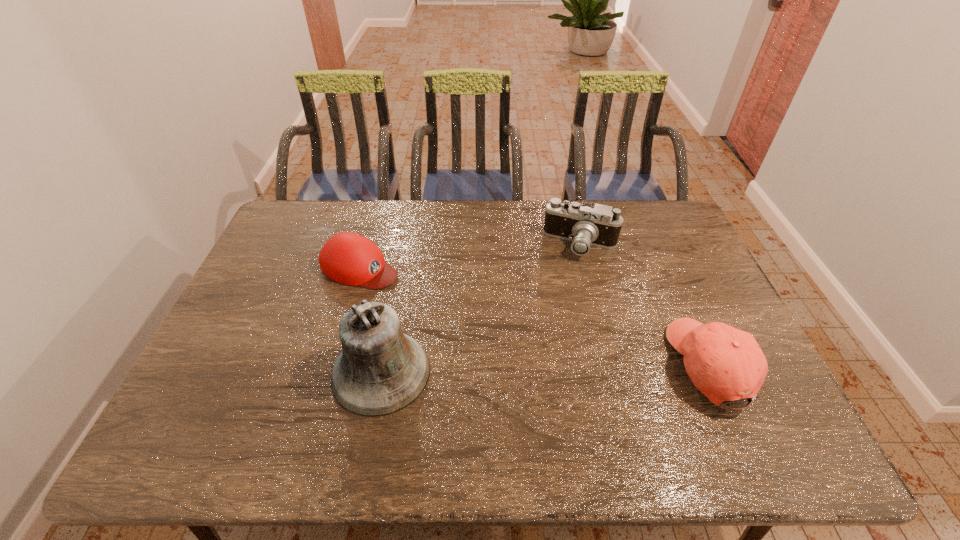
You are a GUI agent. You are given a task and a screenshot of the screen. Output one action in this format:
    pyautogui.click(x=<x>, y=<y>)
    Task: Click on the free space between the taller baseball cap and the shortest object
    
    Given the screenshot: What is the action you would take?
    pyautogui.click(x=536, y=316)

Locate which object is the third closest to the left baseball cap. Please provide its 2D coordinates. Your answer should be formatted as a tuple, i.e. [(x, y)], where the tuple contains the x and y coordinates of a point satisfying the conditions above.

[(726, 364)]

Locate an element on the screen. object that stands as the third closest to the camera is located at coordinates click(x=348, y=258).

The width and height of the screenshot is (960, 540). Find the location of `vacant space that satisfies the following two spatial constraints: 1. on the front side of the third object from left to right; 2. on the left side of the taller baseball cap`. vacant space that satisfies the following two spatial constraints: 1. on the front side of the third object from left to right; 2. on the left side of the taller baseball cap is located at coordinates (612, 366).

Where is `vacant space that satisfies the following two spatial constraints: 1. on the back side of the camera; 2. on the left side of the shortest object`? vacant space that satisfies the following two spatial constraints: 1. on the back side of the camera; 2. on the left side of the shortest object is located at coordinates (367, 245).